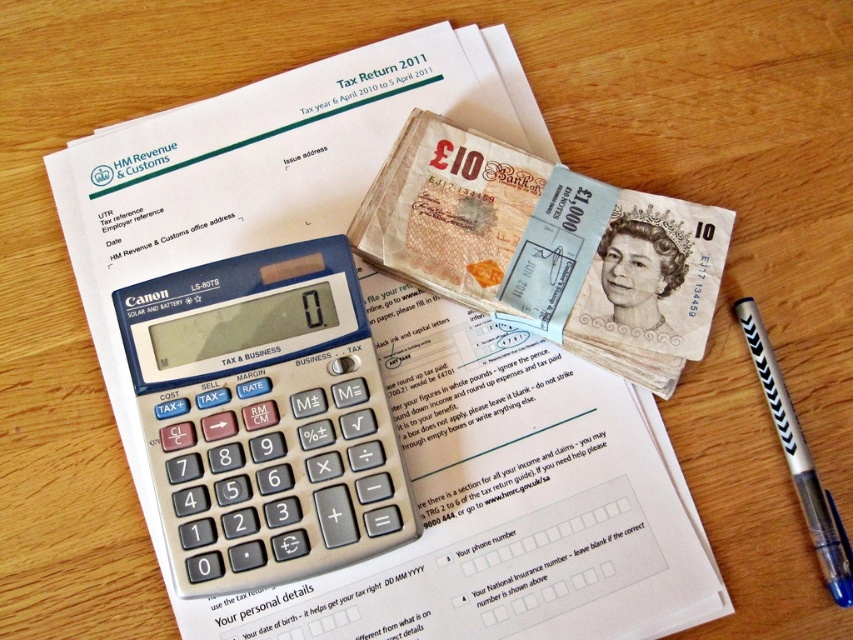
Question: Which object is farther from the camera taking this photo?

Choices:
 (A) black plastic pen at lower right
 (B) light brown paper money at center
 (C) silver metallic calculator at center

Answer: (B)

Question: Does silver metallic calculator at center appear under light brown paper money at center?

Choices:
 (A) yes
 (B) no

Answer: (A)

Question: Can you confirm if silver metallic calculator at center is positioned above black plastic pen at lower right?

Choices:
 (A) no
 (B) yes

Answer: (B)

Question: Among these objects, which one is farthest from the camera?

Choices:
 (A) silver metallic calculator at center
 (B) black plastic pen at lower right
 (C) light brown paper money at center

Answer: (C)

Question: Which of these objects is positioned farthest from the silver metallic calculator at center?

Choices:
 (A) light brown paper money at center
 (B) black plastic pen at lower right

Answer: (B)

Question: From the image, what is the correct spatial relationship of silver metallic calculator at center in relation to black plastic pen at lower right?

Choices:
 (A) below
 (B) above

Answer: (B)